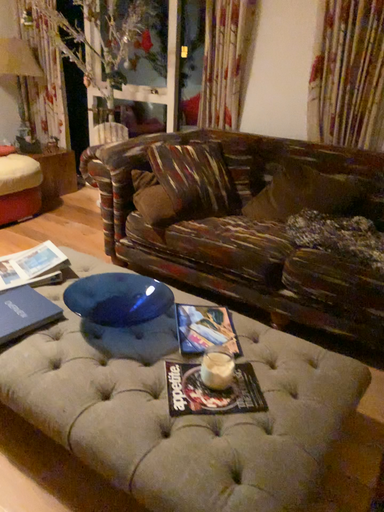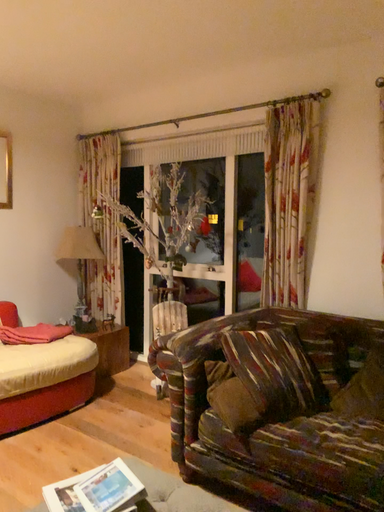
Question: Which way did the camera rotate in the video?

Choices:
 (A) rotated upward
 (B) rotated downward

Answer: (A)